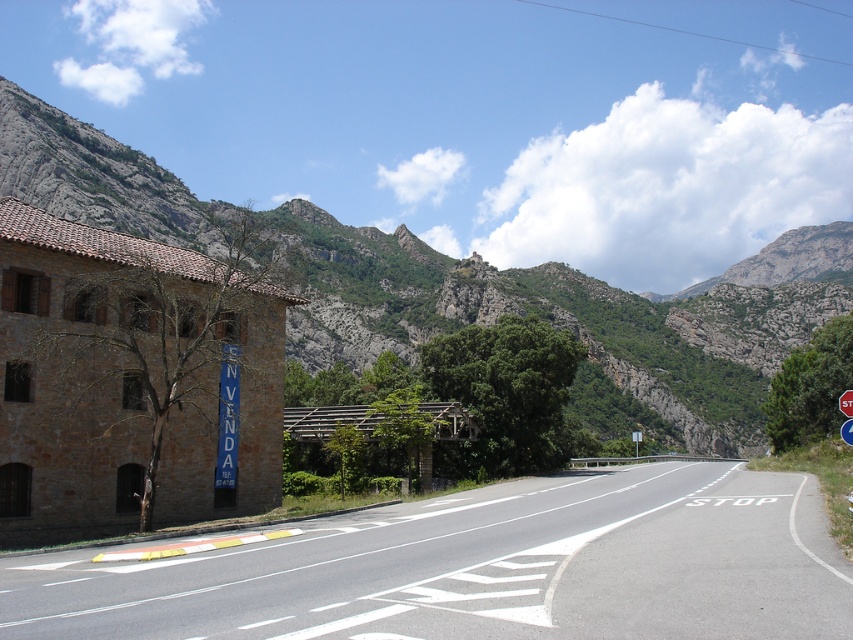
Can you confirm if asphalt road at center is wider than metallic blue stop sign at right?

Yes, asphalt road at center is wider than metallic blue stop sign at right.

Image resolution: width=853 pixels, height=640 pixels. Find the location of `asphalt road at center`. asphalt road at center is located at coordinates (485, 570).

Locate an element on the screen. asphalt road at center is located at coordinates (485, 570).

Which is behind, point (106, 134) or point (844, 420)?

The point (106, 134) is more distant.

Does rugged stone mountain at upper center appear over metallic blue stop sign at right?

Yes.

Between point (15, 120) and point (843, 426), which one is positioned in front?

Point (843, 426) is in front.

Where is `rugged stone mountain at upper center`? This screenshot has height=640, width=853. rugged stone mountain at upper center is located at coordinates (567, 314).

Is asphalt road at center shorter than rugged stone mountain at upper center?

Indeed, asphalt road at center has a lesser height compared to rugged stone mountain at upper center.

Image resolution: width=853 pixels, height=640 pixels. In order to click on asphalt road at center in this screenshot , I will do `click(485, 570)`.

Image resolution: width=853 pixels, height=640 pixels. I want to click on asphalt road at center, so click(x=485, y=570).